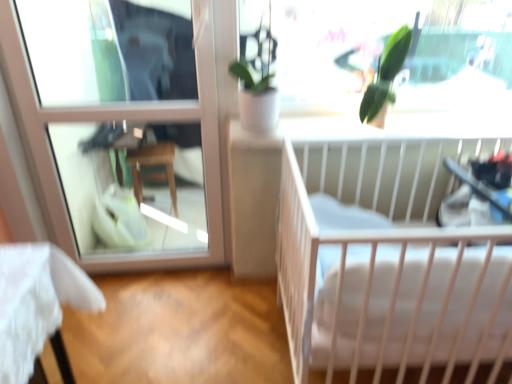
Locate an element on the screen. This screenshot has width=512, height=384. empty space that is ontop of white soft mattress at center (from a real-world perspective) is located at coordinates (435, 251).